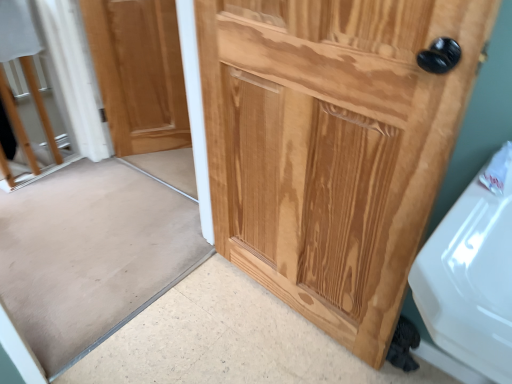
Question: Can you confirm if natural wood screen door at center is shorter than natural wood door at upper left, which is counted as the 1th door, starting from the left?

Choices:
 (A) yes
 (B) no

Answer: (B)

Question: Is natural wood screen door at center positioned before natural wood door at upper left, which is counted as the 1th door, starting from the left?

Choices:
 (A) yes
 (B) no

Answer: (A)

Question: Is natural wood screen door at center aimed at natural wood door at upper left, which is counted as the second door, starting from the front?

Choices:
 (A) yes
 (B) no

Answer: (B)

Question: From a real-world perspective, is natural wood screen door at center positioned under natural wood door at upper left, which is counted as the 1th door, starting from the left, based on gravity?

Choices:
 (A) no
 (B) yes

Answer: (A)

Question: Can you confirm if natural wood screen door at center is positioned to the right of natural wood door at upper left, arranged as the first door when viewed from the back?

Choices:
 (A) yes
 (B) no

Answer: (A)

Question: Does point (404, 122) appear closer or farther from the camera than point (30, 195)?

Choices:
 (A) closer
 (B) farther

Answer: (A)

Question: In the image, is natural wood door at right, acting as the first door starting from the right, on the left side or the right side of natural wood screen door at center?

Choices:
 (A) right
 (B) left

Answer: (A)

Question: From the image's perspective, is natural wood door at right, positioned as the 2th door in left-to-right order, above or below natural wood screen door at center?

Choices:
 (A) below
 (B) above

Answer: (B)

Question: In the image, is natural wood door at right, positioned as the 2th door in left-to-right order, positioned in front of or behind natural wood screen door at center?

Choices:
 (A) front
 (B) behind

Answer: (A)

Question: Looking at their shapes, would you say natural wood screen door at center is wider or thinner than natural wood door at right, acting as the first door starting from the right?

Choices:
 (A) thin
 (B) wide

Answer: (A)

Question: From a real-world perspective, is natural wood screen door at center physically located above or below natural wood door at right, the 1th door from the front?

Choices:
 (A) above
 (B) below

Answer: (B)

Question: From the image's perspective, is natural wood screen door at center positioned above or below natural wood door at right, positioned as the 2th door in left-to-right order?

Choices:
 (A) below
 (B) above

Answer: (A)

Question: Is point coord(38,354) positioned closer to the camera than point coord(267,289)?

Choices:
 (A) farther
 (B) closer

Answer: (B)

Question: From the image's perspective, is natural wood door at upper left, the second door viewed from the right, located above or below natural wood screen door at center?

Choices:
 (A) above
 (B) below

Answer: (A)

Question: Looking at the image, does natural wood door at upper left, the second door viewed from the right, seem bigger or smaller compared to natural wood screen door at center?

Choices:
 (A) small
 (B) big

Answer: (A)